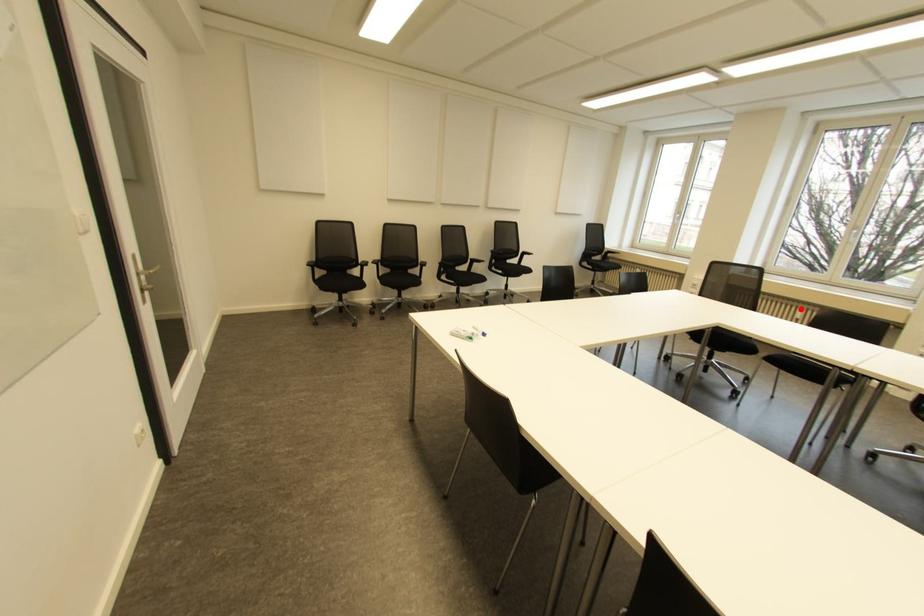
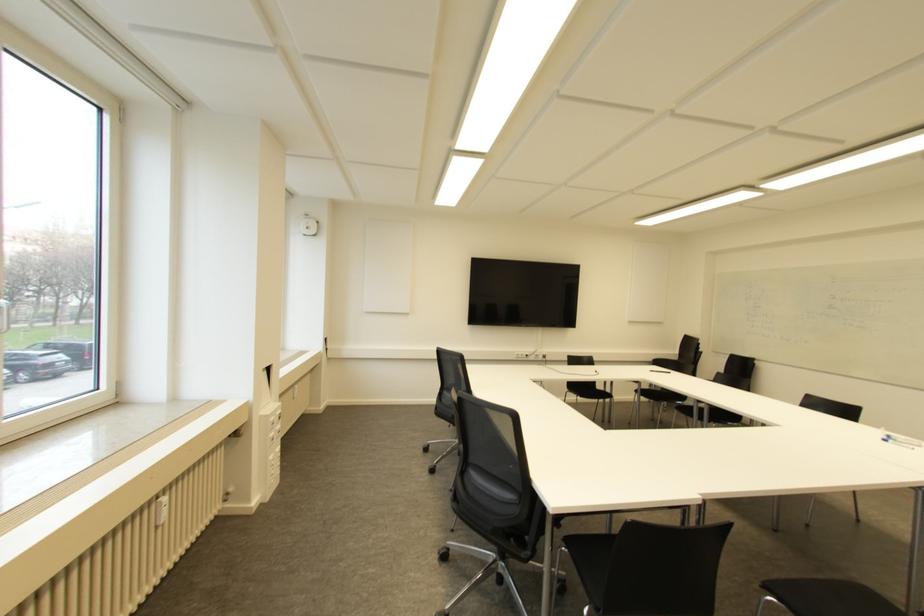
Question: A red point is marked in image1. In image2, is the corresponding 3D point closer to the camera or farther? Reply with the corresponding letter.

Choices:
 (A) The corresponding 3D point is closer.
 (B) The corresponding 3D point is farther.

Answer: (A)